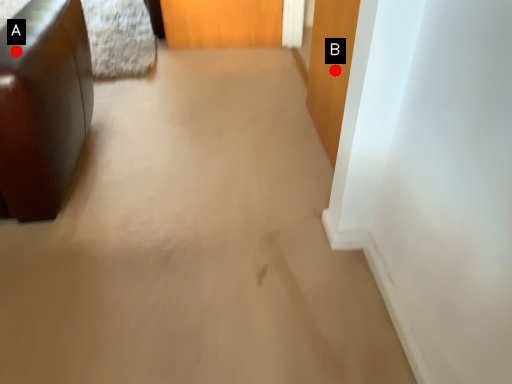
Question: Two points are circled on the image, labeled by A and B beside each circle. Which of the following is the farthest from the observer?

Choices:
 (A) A is further
 (B) B is further

Answer: (B)